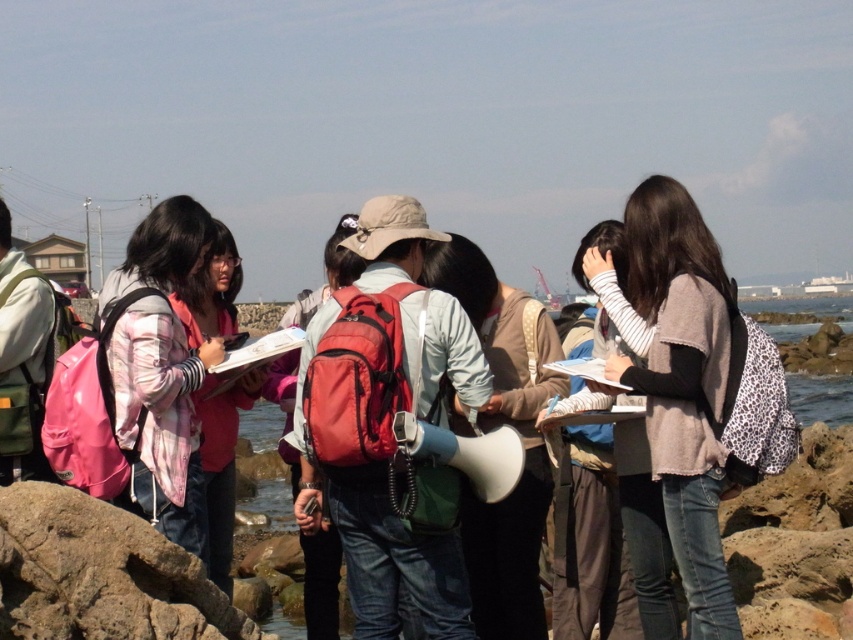
Question: Does gray sweater at center have a larger size compared to rough textured rock at lower left?

Choices:
 (A) no
 (B) yes

Answer: (B)

Question: Which of the following is the farthest from the observer?

Choices:
 (A) (334, 557)
 (B) (827, 387)

Answer: (B)

Question: Can you confirm if pink fabric jacket at left is thinner than matte red backpack at center?

Choices:
 (A) yes
 (B) no

Answer: (A)

Question: Estimate the real-world distances between objects in this image. Which object is closer to the clear water at lower right?

Choices:
 (A) pink fabric jacket at left
 (B) gray sweater at center

Answer: (A)

Question: Is pink fabric jacket at center positioned at the back of matte red backpack at center?

Choices:
 (A) no
 (B) yes

Answer: (A)

Question: Based on their relative distances, which object is farther from the matte gray megaphone at center?

Choices:
 (A) clear water at lower right
 (B) pink fabric jacket at left
 (C) rough textured rock at lower left
 (D) gray sweater at center

Answer: (A)